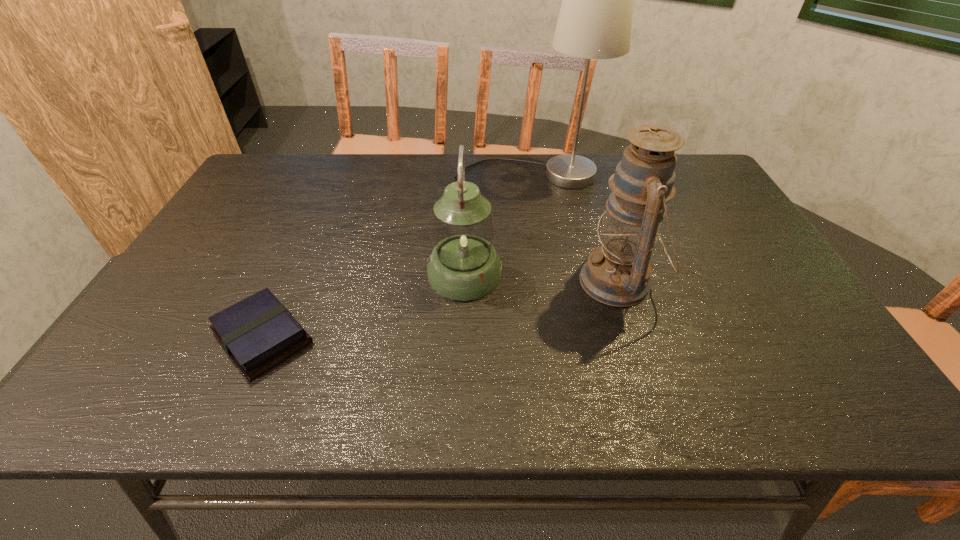
Find the location of a particular element. This screenshot has height=540, width=960. table lamp is located at coordinates click(595, 19).

The height and width of the screenshot is (540, 960). Identify the location of the farthest object. (595, 19).

Where is `the second tallest object`? the second tallest object is located at coordinates (617, 273).

I want to click on lantern, so click(463, 265).

Find the location of a particular element. The image size is (960, 540). the leftmost object is located at coordinates (258, 333).

Find the location of a particular element. The height and width of the screenshot is (540, 960). the shortest object is located at coordinates (258, 333).

Locate an element on the screen. The image size is (960, 540). vacant space located on the front of the tallest object is located at coordinates (540, 256).

Where is `vacant point located 0.130m on the right of the third shortest object`? The image size is (960, 540). vacant point located 0.130m on the right of the third shortest object is located at coordinates (708, 282).

This screenshot has width=960, height=540. I want to click on free space located on the back of the third tallest object, so click(468, 207).

Identify the location of vacant region located on the back of the book. tap(320, 211).